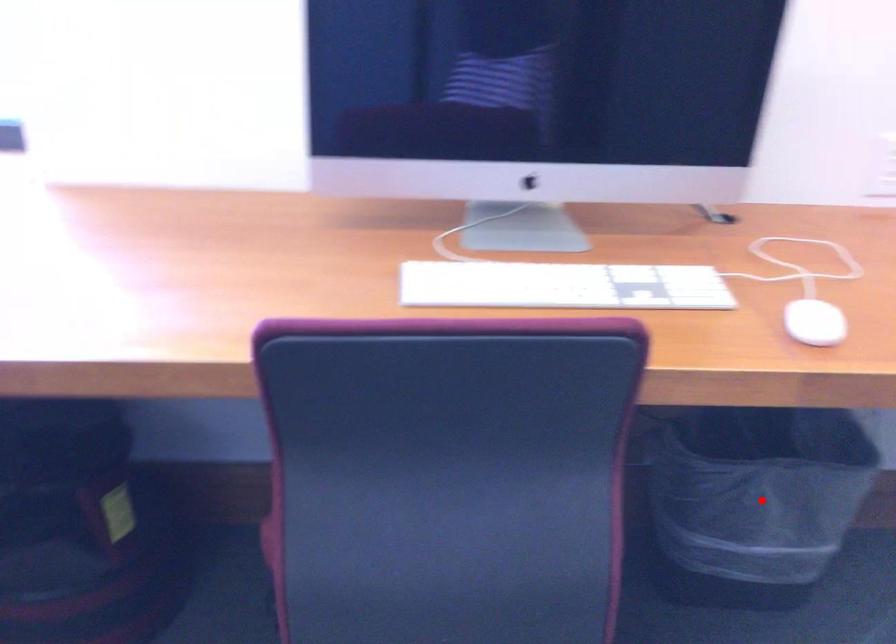
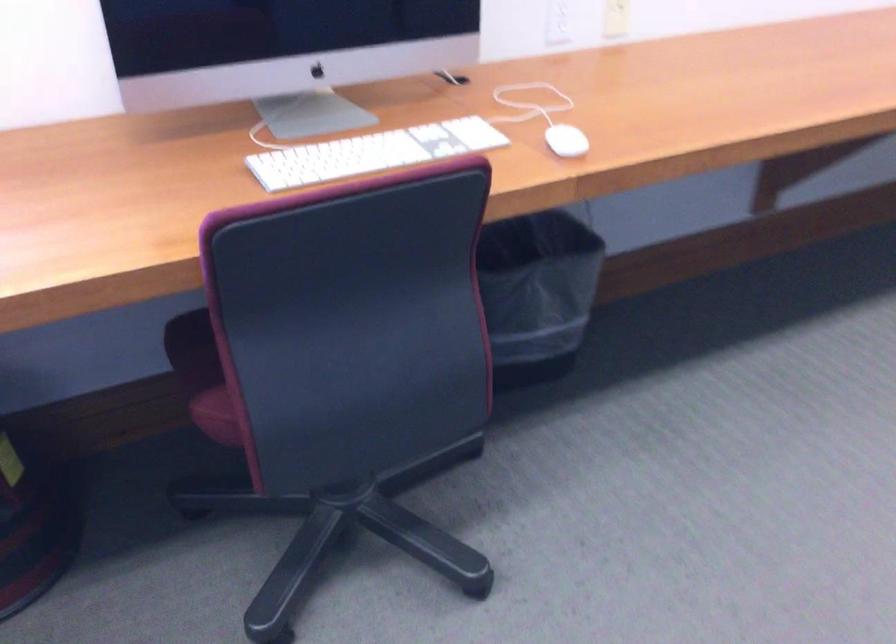
The point at the highlighted location is marked in the first image. Where is the corresponding point in the second image?

(536, 292)